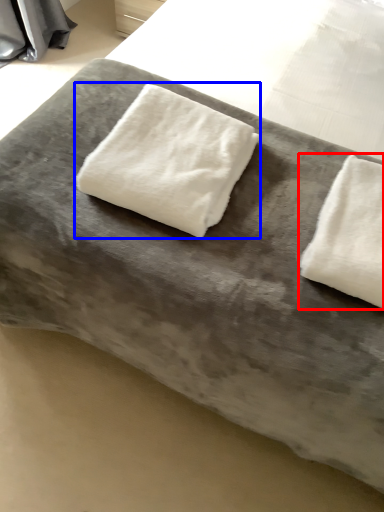
Question: Which object appears farthest to the camera in this image, towel (highlighted by a red box) or towel (highlighted by a blue box)?

Choices:
 (A) towel
 (B) towel

Answer: (B)